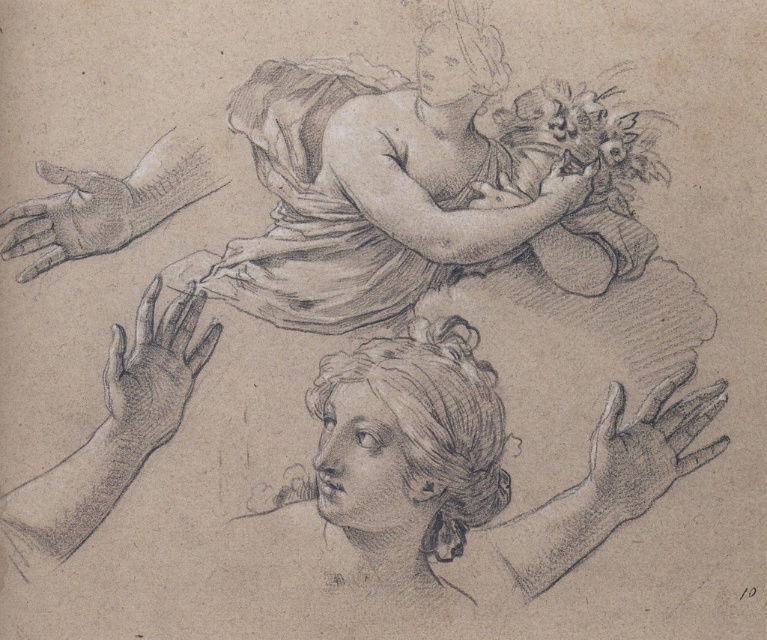
What are the coordinates of the smooth fabric head at upper center?

The smooth fabric head at upper center is located at point (288, 118).

Based on the photo, you are an art student analyzing the sketch. You notice the smooth fabric head at upper center and the smooth skin hand at upper center. Which object is closer to you in this drawing?

The smooth fabric head at upper center is closer to you than the smooth skin hand at upper center because it is positioned further to the viewer in the sketch.

You are an artist analyzing the pencil sketch. You notice two elements with smooth gray tones. The first is the smooth gray hair at lower center, and the second is the smooth gray glove at left. Which of these elements has a larger size in the artwork?

The smooth gray hair at lower center is bigger than the smooth gray glove at left, so the smooth gray hair at lower center has a larger size in the artwork.